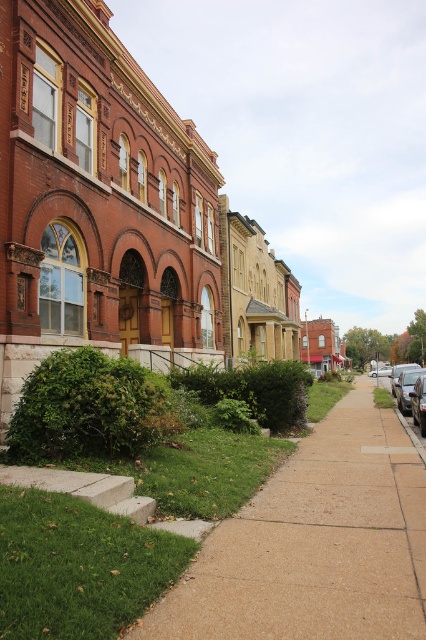
Question: Based on their relative distances, which object is farther from the metallic silver sedan at right?

Choices:
 (A) silver metallic sedan at center-right
 (B) brown concrete sidewalk at lower center
 (C) shiny silver sedan at right

Answer: (A)

Question: Which object appears closest to the camera in this image?

Choices:
 (A) brown concrete sidewalk at lower center
 (B) silver metallic sedan at center-right
 (C) metallic silver sedan at right

Answer: (A)

Question: Can you confirm if brown concrete sidewalk at lower center is thinner than shiny silver sedan at right?

Choices:
 (A) yes
 (B) no

Answer: (B)

Question: Does brown concrete sidewalk at lower center have a smaller size compared to silver metallic sedan at center-right?

Choices:
 (A) no
 (B) yes

Answer: (B)

Question: Is brown concrete sidewalk at lower center smaller than metallic silver sedan at right?

Choices:
 (A) no
 (B) yes

Answer: (A)

Question: Estimate the real-world distances between objects in this image. Which object is closer to the metallic silver sedan at right?

Choices:
 (A) brown concrete sidewalk at lower center
 (B) silver metallic sedan at center-right
 (C) shiny silver sedan at right

Answer: (A)